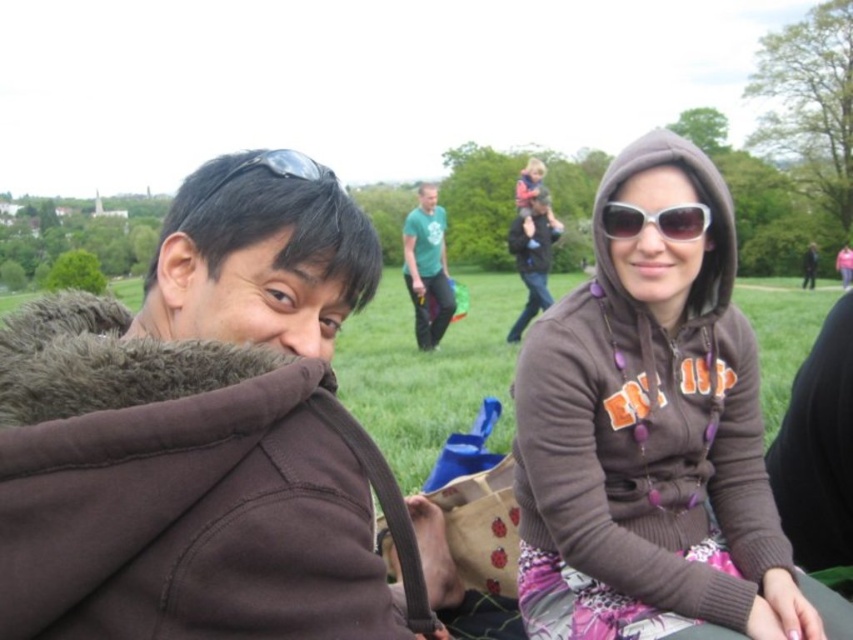
Question: Among these points, which one is nearest to the camera?

Choices:
 (A) (560, 374)
 (B) (62, 328)
 (C) (527, 166)
 (D) (662, 236)

Answer: (B)

Question: Considering the real-world distances, which object is farthest from the matte pink hoodie at upper center?

Choices:
 (A) sunglasses at center
 (B) brown fuzzy jacket at left

Answer: (B)

Question: Is brown fuzzy jacket at left bigger than green fabric shirt at center?

Choices:
 (A) yes
 (B) no

Answer: (B)

Question: Can you confirm if brown fuzzy jacket at left is bigger than sunglasses at center?

Choices:
 (A) yes
 (B) no

Answer: (A)

Question: Which of these objects is positioned closest to the sunglasses at center?

Choices:
 (A) brown fuzzy jacket at left
 (B) brown hoodie at center

Answer: (B)

Question: Can you confirm if brown fuzzy jacket at left is positioned above brown hoodie at center?

Choices:
 (A) no
 (B) yes

Answer: (B)